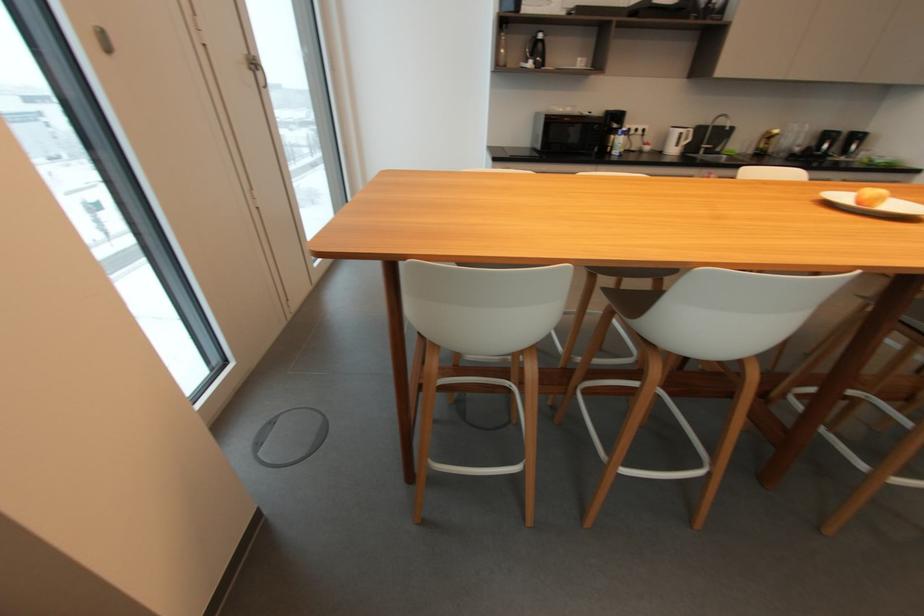
What do you see at coordinates (103, 39) in the screenshot? I see `a window handle` at bounding box center [103, 39].